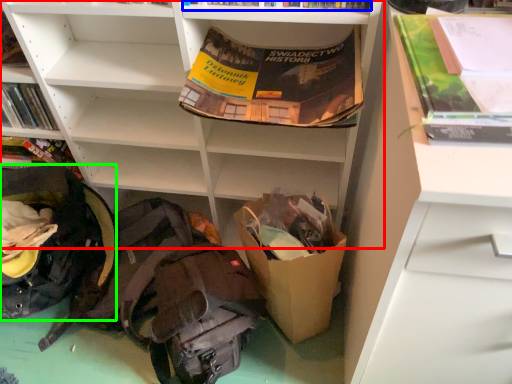
Question: Which is nearer to the shelf (highlighted by a red box)? book (highlighted by a blue box) or backpack (highlighted by a green box).

Choices:
 (A) book
 (B) backpack

Answer: (B)